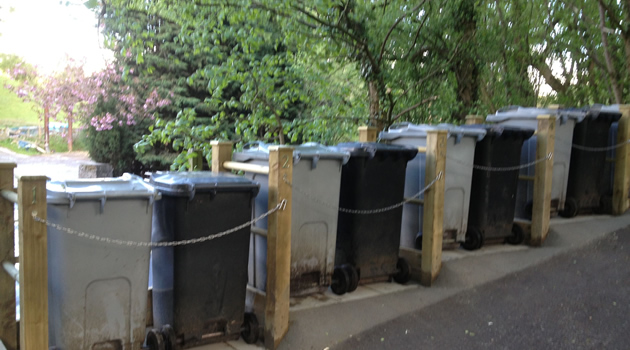
This screenshot has width=630, height=350. I want to click on garbage bins, so click(123, 223), click(193, 223), click(306, 172), click(370, 171), click(462, 142), click(504, 142), click(564, 138), click(602, 136).